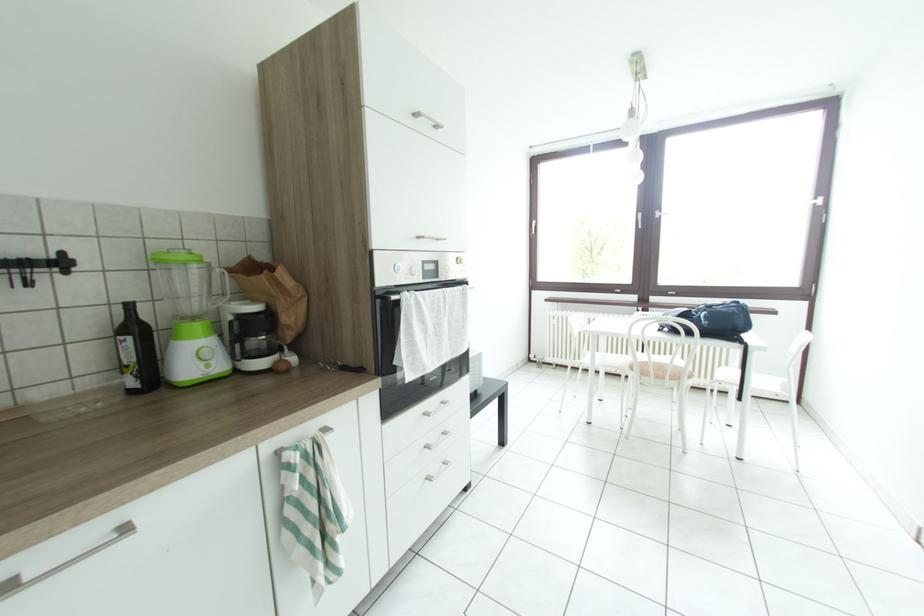
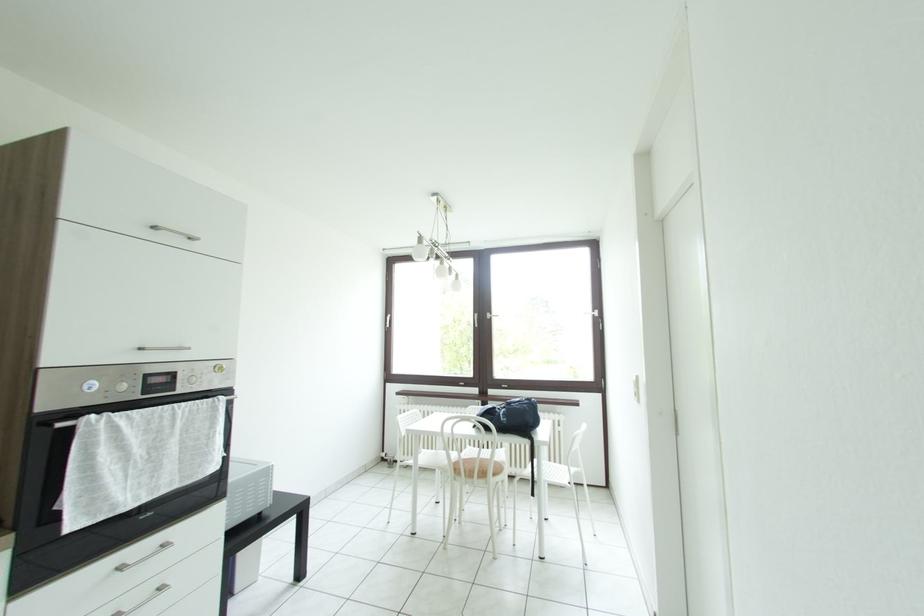
Question: Which direction would the cameraman need to move to produce the second image? Reply with the corresponding letter.

Choices:
 (A) Left
 (B) Right
 (C) Forward
 (D) Backward

Answer: (B)